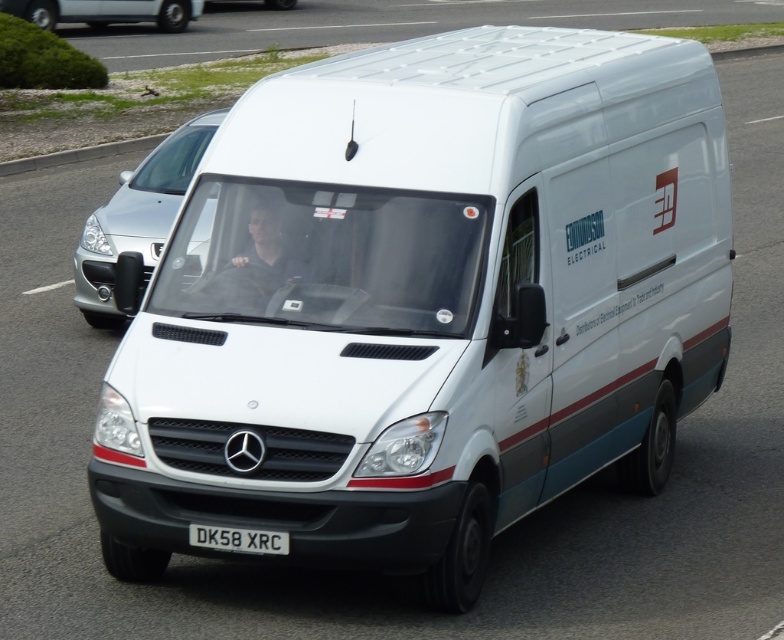
Question: Is silver metallic van at upper left to the right of white plastic license plate at center from the viewer's perspective?

Choices:
 (A) yes
 (B) no

Answer: (B)

Question: Which point is farther to the camera?

Choices:
 (A) (78, 12)
 (B) (249, 538)

Answer: (A)

Question: Is satin silver car at left wider than white plastic license plate at center?

Choices:
 (A) no
 (B) yes

Answer: (B)

Question: Which of the following is the closest to the observer?

Choices:
 (A) satin silver car at left
 (B) white plastic license plate at center

Answer: (B)

Question: Which object appears closest to the camera in this image?

Choices:
 (A) white plastic license plate at center
 (B) silver metallic van at upper left
 (C) satin silver car at left

Answer: (A)

Question: Can you confirm if satin silver car at left is positioned above silver metallic van at upper left?

Choices:
 (A) yes
 (B) no

Answer: (B)